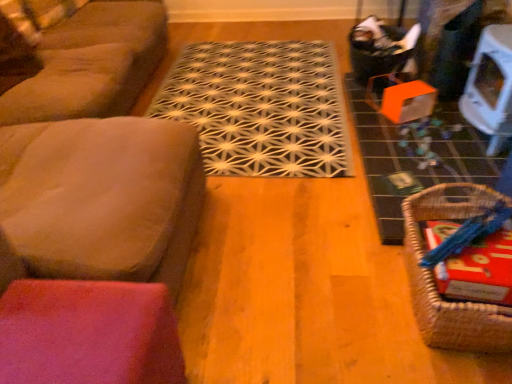
Question: From a real-world perspective, is suede-like brown couch at left on suede-like brown couch at left?

Choices:
 (A) no
 (B) yes

Answer: (B)

Question: From the image's perspective, is suede-like brown couch at left beneath suede-like brown couch at left?

Choices:
 (A) no
 (B) yes

Answer: (B)

Question: Is suede-like brown couch at left outside suede-like brown couch at left?

Choices:
 (A) yes
 (B) no

Answer: (A)

Question: Would you say suede-like brown couch at left is part of suede-like brown couch at left's contents?

Choices:
 (A) no
 (B) yes

Answer: (A)

Question: Does suede-like brown couch at left turn towards suede-like brown couch at left?

Choices:
 (A) yes
 (B) no

Answer: (B)

Question: From the image's perspective, relative to suede-like brown couch at left, is black woven mat at center above or below?

Choices:
 (A) above
 (B) below

Answer: (A)

Question: Is black woven mat at center taller or shorter than suede-like brown couch at left?

Choices:
 (A) tall
 (B) short

Answer: (B)

Question: Considering their positions, is black woven mat at center located in front of or behind suede-like brown couch at left?

Choices:
 (A) front
 (B) behind

Answer: (B)

Question: From a real-world perspective, is black woven mat at center above or below suede-like brown couch at left?

Choices:
 (A) above
 (B) below

Answer: (B)

Question: Considering the positions of suede-like brown couch at left and white glossy table at upper right in the image, is suede-like brown couch at left taller or shorter than white glossy table at upper right?

Choices:
 (A) short
 (B) tall

Answer: (B)

Question: From the image's perspective, relative to white glossy table at upper right, is suede-like brown couch at left above or below?

Choices:
 (A) below
 (B) above

Answer: (B)

Question: Would you say suede-like brown couch at left is to the left or to the right of white glossy table at upper right in the picture?

Choices:
 (A) right
 (B) left

Answer: (B)

Question: Do you think suede-like brown couch at left is within white glossy table at upper right, or outside of it?

Choices:
 (A) outside
 (B) inside

Answer: (A)

Question: Considering their positions, is suede-like brown couch at left located in front of or behind woven brown basket at lower right?

Choices:
 (A) behind
 (B) front

Answer: (A)

Question: Is suede-like brown couch at left wider or thinner than woven brown basket at lower right?

Choices:
 (A) wide
 (B) thin

Answer: (A)